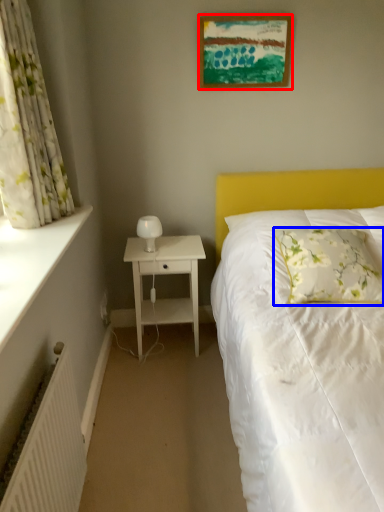
Question: Which point is further to the camera, picture frame (highlighted by a red box) or pillow (highlighted by a blue box)?

Choices:
 (A) picture frame
 (B) pillow

Answer: (A)